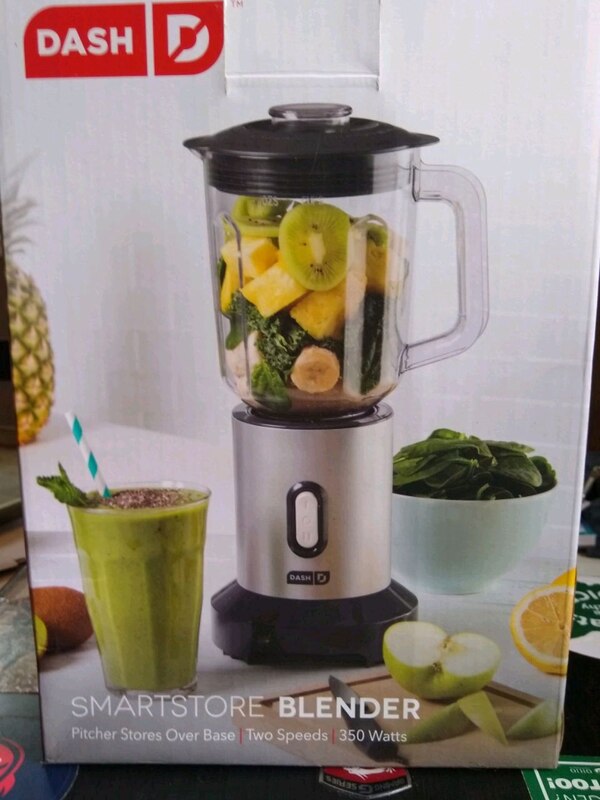
Image resolution: width=600 pixels, height=800 pixels. Identify the location of blender. (305, 576).